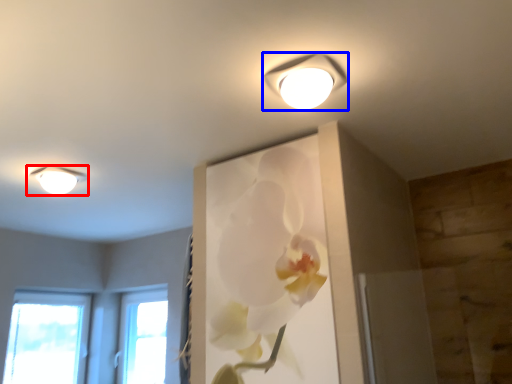
Question: Among these objects, which one is farthest to the camera, lamp (highlighted by a red box) or lamp (highlighted by a blue box)?

Choices:
 (A) lamp
 (B) lamp

Answer: (A)